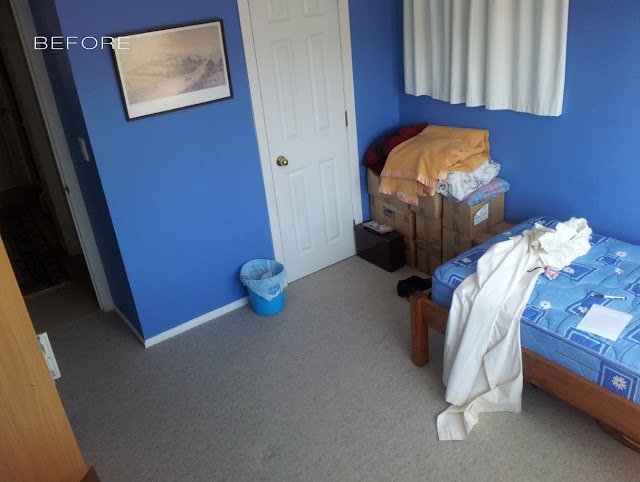
The width and height of the screenshot is (640, 482). Identify the location of grey carpet. (278, 433).